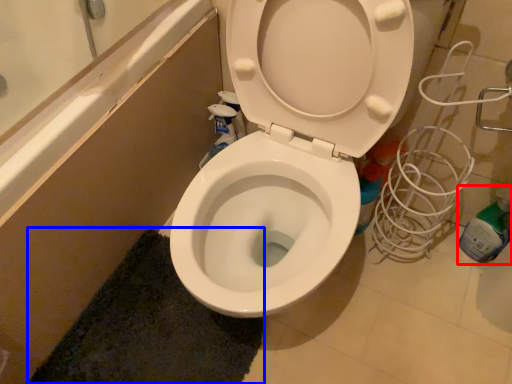
Question: Which object is further to the camera taking this photo, bottle (highlighted by a red box) or bath mat (highlighted by a blue box)?

Choices:
 (A) bottle
 (B) bath mat

Answer: (A)